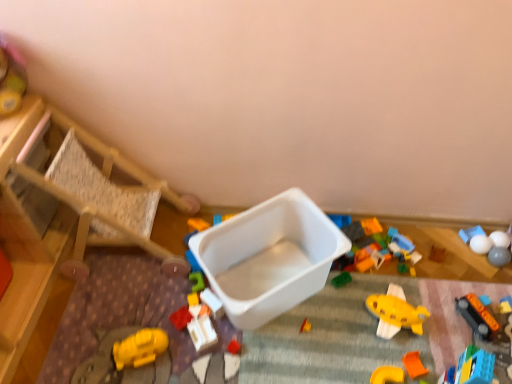
You are a GUI agent. You are given a task and a screenshot of the screen. Output one action in this format:
    pyautogui.click(x=<x>, y=<y>)
    Task: Click on the spots to the right of yellow matte airplane at center, which appears as the 7th toy when viewed from the left
    The width and height of the screenshot is (512, 384).
    Given the screenshot: What is the action you would take?
    pyautogui.click(x=445, y=320)